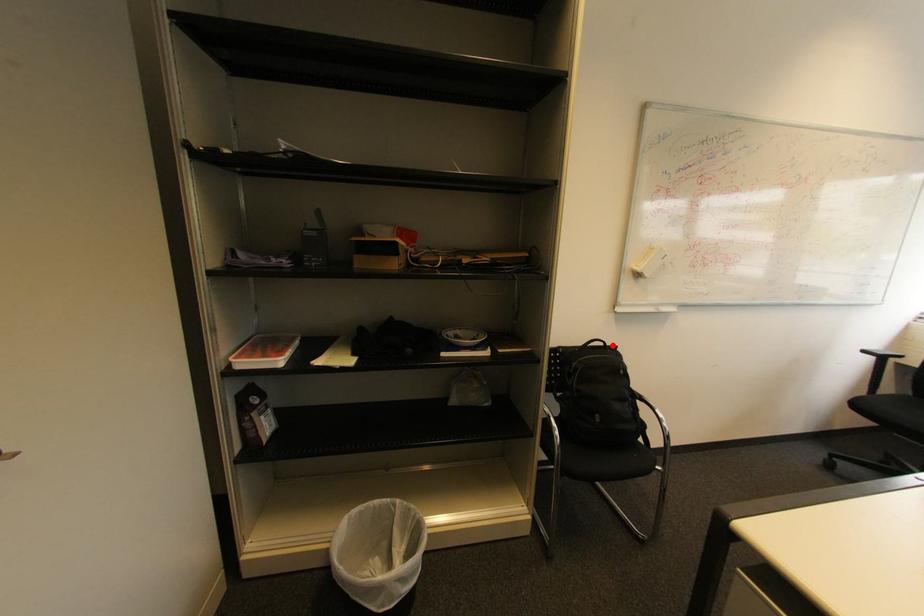
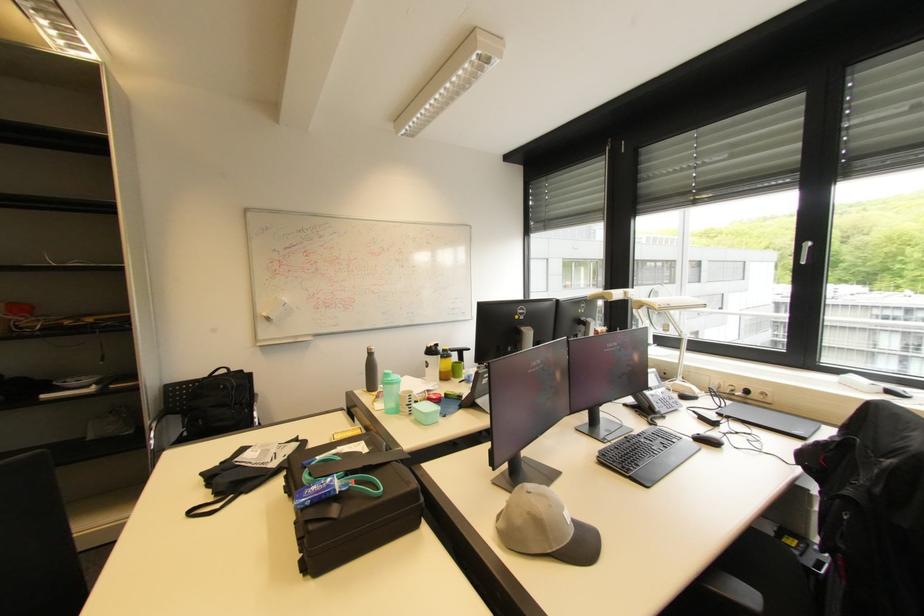
In the second image, find the point that corresponds to the highlighted location in the first image.

(237, 371)